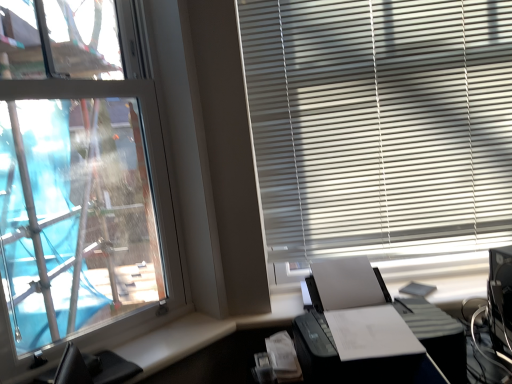
Question: Does white matte blinds at upper right have a lesser width compared to black plastic printer at lower right?

Choices:
 (A) no
 (B) yes

Answer: (B)

Question: Is white matte blinds at upper right in contact with black plastic printer at lower right?

Choices:
 (A) no
 (B) yes

Answer: (A)

Question: From the image's perspective, would you say white matte blinds at upper right is shown under black plastic printer at lower right?

Choices:
 (A) yes
 (B) no

Answer: (B)

Question: Is the depth of white matte blinds at upper right less than that of black plastic printer at lower right?

Choices:
 (A) no
 (B) yes

Answer: (A)

Question: Can you confirm if white matte blinds at upper right is positioned to the left of black plastic printer at lower right?

Choices:
 (A) no
 (B) yes

Answer: (A)

Question: From the image's perspective, is white matte blinds at upper right above or below black leather computer chair at lower left?

Choices:
 (A) above
 (B) below

Answer: (A)

Question: Is white matte blinds at upper right inside the boundaries of black leather computer chair at lower left, or outside?

Choices:
 (A) inside
 (B) outside

Answer: (B)

Question: Considering the positions of white matte blinds at upper right and black leather computer chair at lower left in the image, is white matte blinds at upper right taller or shorter than black leather computer chair at lower left?

Choices:
 (A) short
 (B) tall

Answer: (B)

Question: Is point (297, 51) closer or farther from the camera than point (49, 379)?

Choices:
 (A) closer
 (B) farther

Answer: (B)

Question: Does point (361, 294) appear closer or farther from the camera than point (100, 31)?

Choices:
 (A) farther
 (B) closer

Answer: (B)

Question: From a real-world perspective, is black plastic printer at lower right physically located above or below transparent glass window at left?

Choices:
 (A) below
 (B) above

Answer: (A)

Question: Is black plastic printer at lower right bigger or smaller than transparent glass window at left?

Choices:
 (A) big
 (B) small

Answer: (A)

Question: From the image's perspective, relative to transparent glass window at left, is black plastic printer at lower right above or below?

Choices:
 (A) below
 (B) above

Answer: (A)

Question: From a real-world perspective, relative to black plastic printer at lower right, is transparent glass window at left vertically above or below?

Choices:
 (A) below
 (B) above

Answer: (B)

Question: From their relative heights in the image, would you say transparent glass window at left is taller or shorter than black plastic printer at lower right?

Choices:
 (A) tall
 (B) short

Answer: (A)